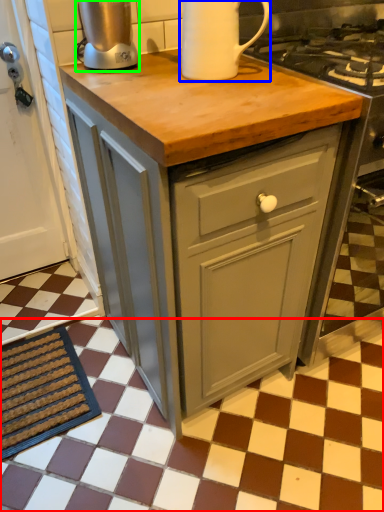
Question: Which object is the farthest from tile (highlighted by a red box)? Choose among these: kitchen appliance (highlighted by a blue box) or kitchen appliance (highlighted by a green box).

Choices:
 (A) kitchen appliance
 (B) kitchen appliance

Answer: (B)